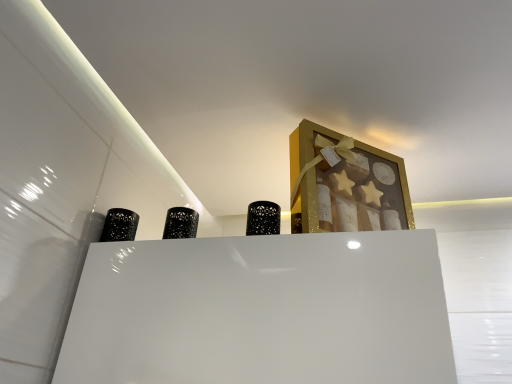
In order to face gold glitter picture frame at upper center, should I rotate leftwards or rightwards?

To face it directly, rotate right by 13.241 degrees.

This screenshot has width=512, height=384. Find the location of `gold glitter picture frame at upper center`. gold glitter picture frame at upper center is located at coordinates (345, 184).

Describe the element at coordinates (345, 184) in the screenshot. I see `gold glitter picture frame at upper center` at that location.

Where is `gold glitter picture frame at upper center`? The height and width of the screenshot is (384, 512). gold glitter picture frame at upper center is located at coordinates (345, 184).